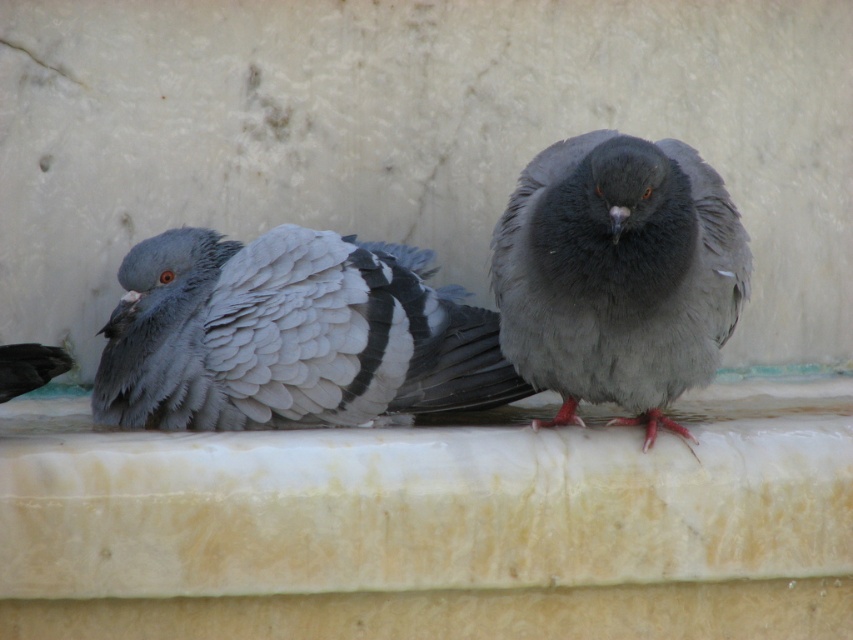
Can you confirm if gray matte feathers at center is positioned to the left of gray matte pigeon at center?

Correct, you'll find gray matte feathers at center to the left of gray matte pigeon at center.

Is gray matte feathers at center above gray matte pigeon at center?

No.

Describe the element at coordinates (288, 336) in the screenshot. The width and height of the screenshot is (853, 640). I see `gray matte feathers at center` at that location.

Locate an element on the screen. This screenshot has width=853, height=640. gray matte feathers at center is located at coordinates (288, 336).